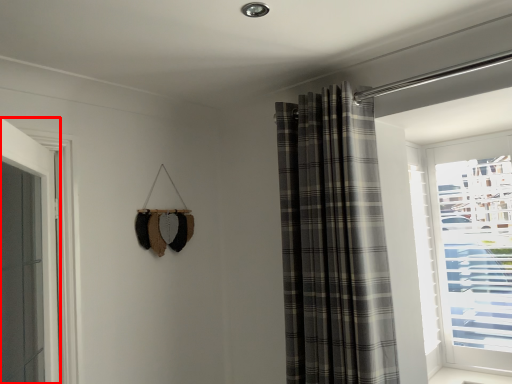
Question: In this image, where is door (annotated by the red box) located relative to curtain?

Choices:
 (A) left
 (B) right

Answer: (A)